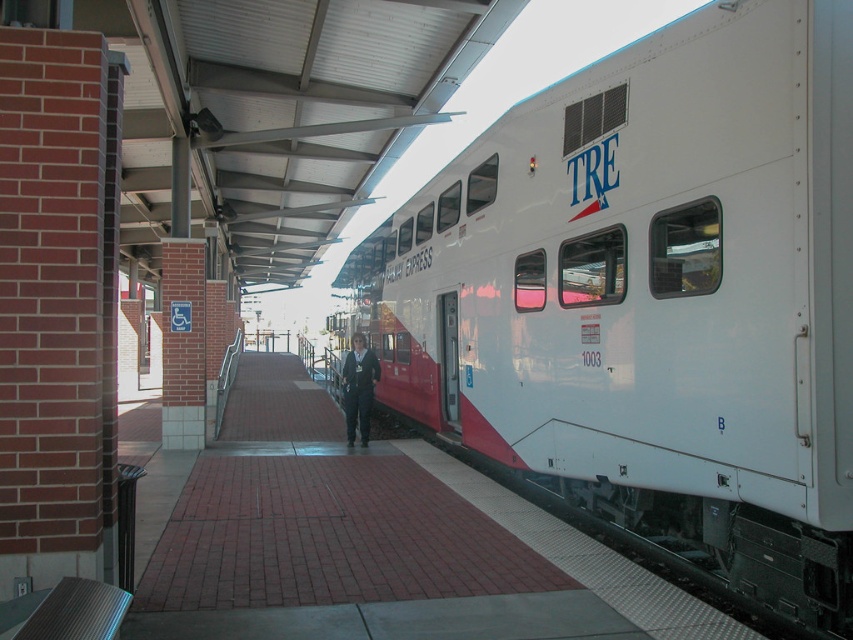
Is white glossy train car at center wider than dark blue fabric jacket at center?

Yes, white glossy train car at center is wider than dark blue fabric jacket at center.

From the picture: Can you confirm if white glossy train car at center is smaller than dark blue fabric jacket at center?

Actually, white glossy train car at center might be larger than dark blue fabric jacket at center.

Between point (813, 76) and point (357, 369), which one is positioned behind?

The point (357, 369) is more distant.

Locate an element on the screen. white glossy train car at center is located at coordinates (653, 294).